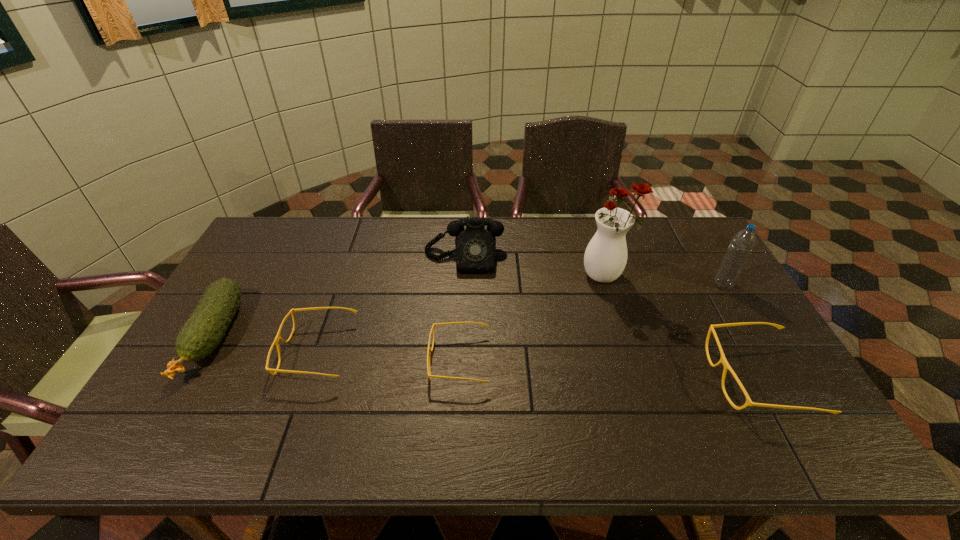
I want to click on vacant point that satisfies the following two spatial constraints: 1. on the dial of the telephone; 2. in front of the lenses of the shortest object, so click(x=460, y=360).

Where is `blank area in the image that satisfies the following two spatial constraints: 1. on the dial of the sixth shortest object; 2. on the right side of the third tallest object`? Image resolution: width=960 pixels, height=540 pixels. blank area in the image that satisfies the following two spatial constraints: 1. on the dial of the sixth shortest object; 2. on the right side of the third tallest object is located at coordinates (463, 285).

Where is `free point that satisfies the following two spatial constraints: 1. on the dial of the third tallest object; 2. in front of the lenses of the leftmost spectacles`? The image size is (960, 540). free point that satisfies the following two spatial constraints: 1. on the dial of the third tallest object; 2. in front of the lenses of the leftmost spectacles is located at coordinates (460, 352).